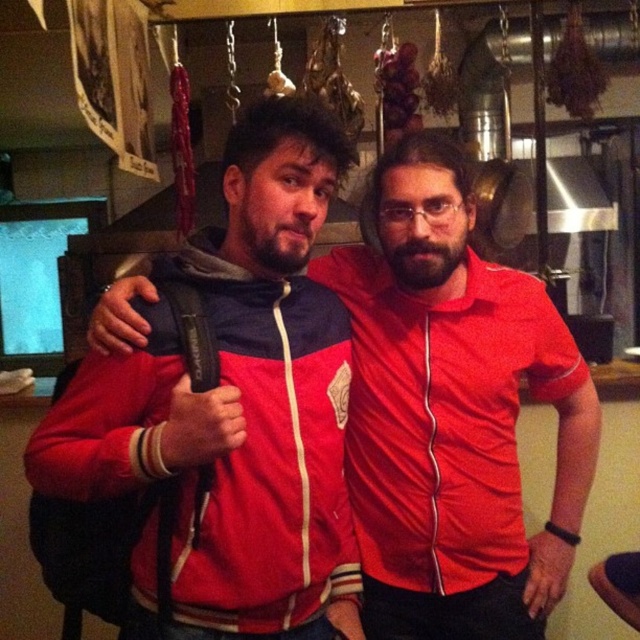
You are a photographer trying to capture a candid shot of the two people in the scene. You need to know which person is standing to the left of the other to frame your shot properly. Which of the two, the red matte jacket at center or the matte red shirt at center, is positioned to the left?

The red matte jacket at center is positioned on the left side of matte red shirt at center, so the red matte jacket at center is to the left.

Looking at this image, you are standing in a room where two people are positioned closely. You notice a point at coordinates (268, 456). Based on the scene, what object or clothing item is located at this point?

The point at coordinates (268, 456) marks the red and white zip up jacket at center.